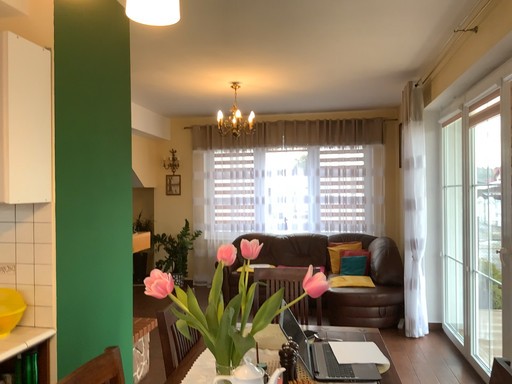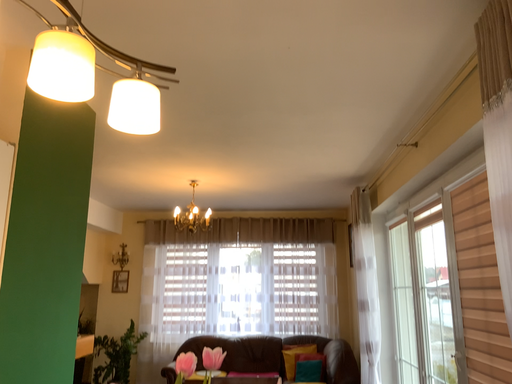
Question: Which way did the camera rotate in the video?

Choices:
 (A) rotated left
 (B) rotated right

Answer: (B)